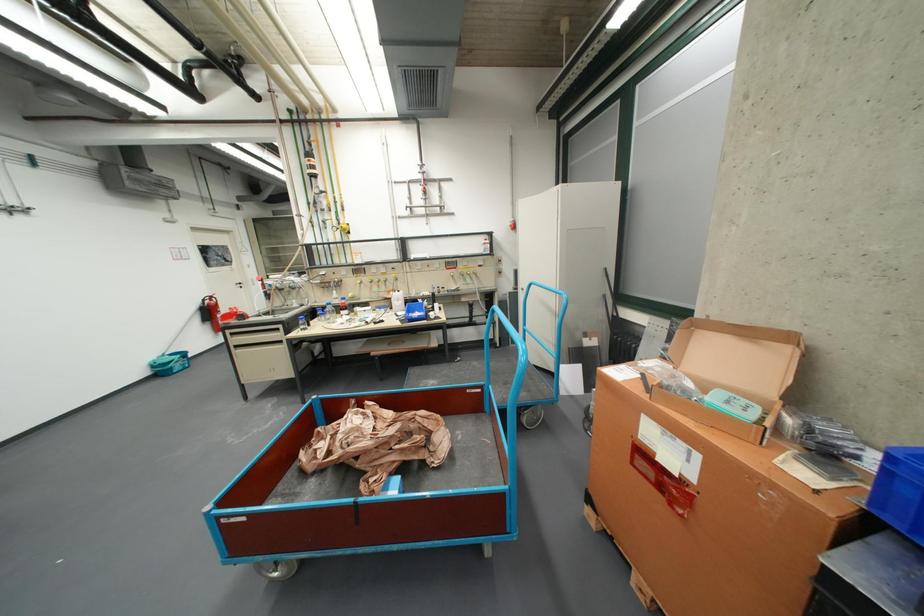
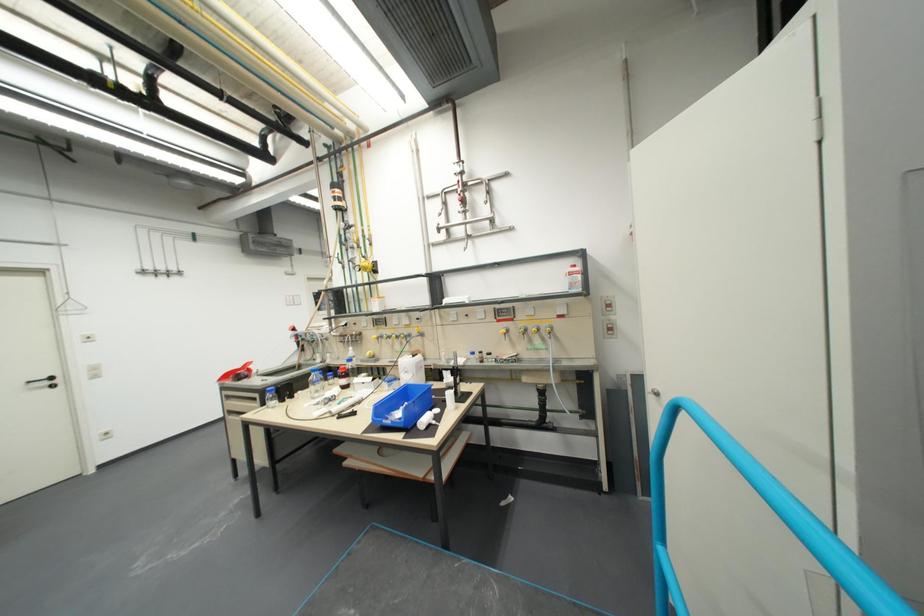
The point at (x=439, y=318) is marked in the first image. Where is the corresponding point in the second image?

(420, 428)